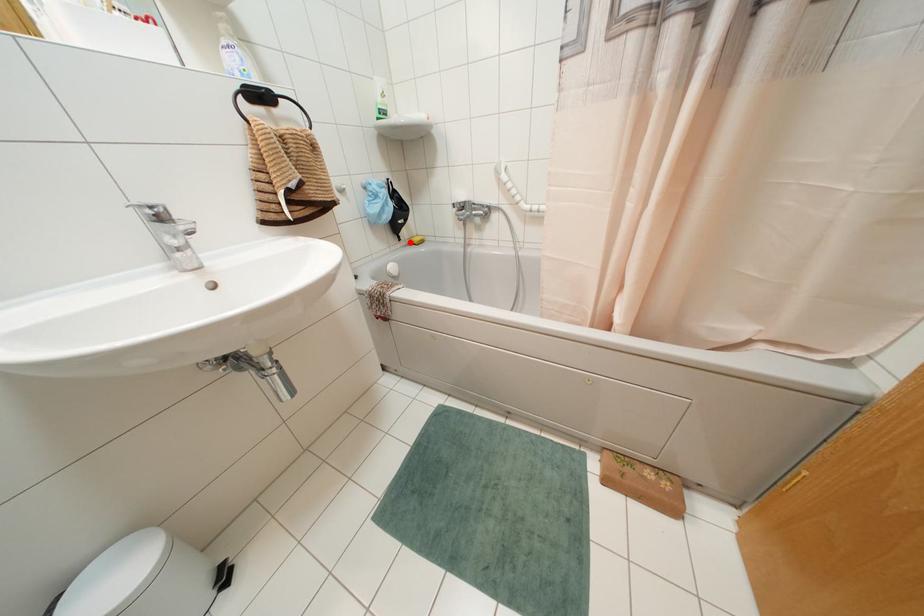
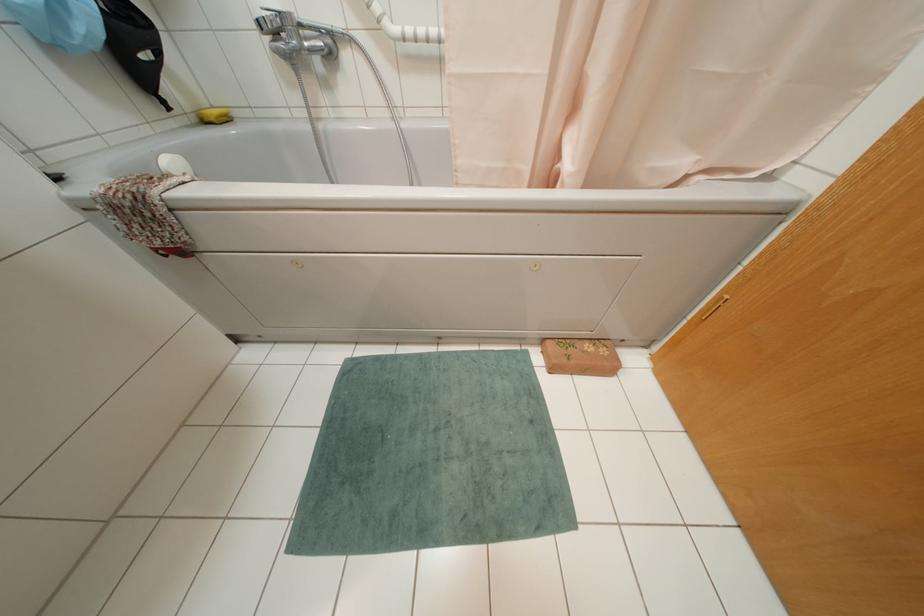
Find the pixel in the second image that matches the highlighted location in the first image.

(202, 121)